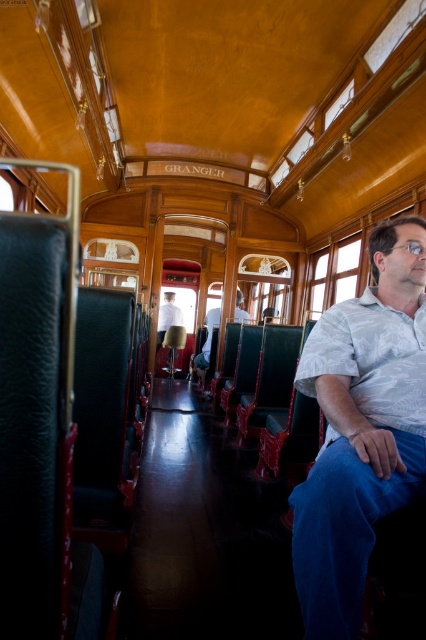
Who is more forward, (340, 396) or (166, 314)?

Point (340, 396) is in front.

In the scene shown: Who is positioned more to the left, white cotton shirt at center or white shirt at center?

From the viewer's perspective, white shirt at center appears more on the left side.

At what (x,y) coordinates should I click in order to perform the action: click on white cotton shirt at center. Please return your answer as a coordinate pair (x, y). This screenshot has width=426, height=640. Looking at the image, I should click on (362, 428).

Looking at this image, can you confirm if light blue shirt at center is positioned to the left of white shirt at center?

In fact, light blue shirt at center is to the right of white shirt at center.

The image size is (426, 640). I want to click on light blue shirt at center, so click(207, 339).

Does white cotton shirt at center appear on the right side of light blue shirt at center?

Indeed, white cotton shirt at center is positioned on the right side of light blue shirt at center.

Describe the element at coordinates (362, 428) in the screenshot. Image resolution: width=426 pixels, height=640 pixels. I see `white cotton shirt at center` at that location.

Measure the distance between point (x=317, y=632) and camera.

A distance of 4.04 feet exists between point (x=317, y=632) and camera.

The image size is (426, 640). What are the coordinates of `white cotton shirt at center` in the screenshot? It's located at (362, 428).